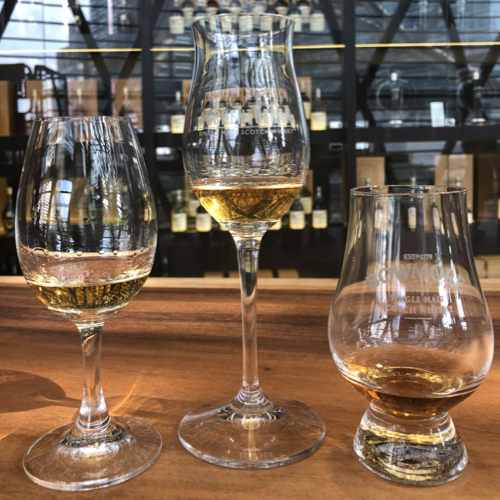
Image resolution: width=500 pixels, height=500 pixels. I want to click on counter, so click(155, 488).